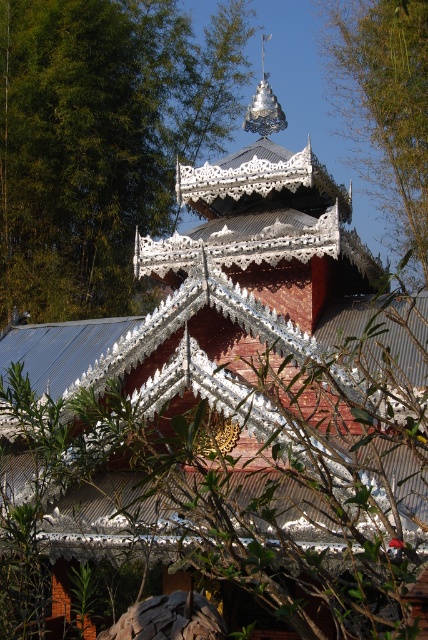
Is green leafy tree at upper left shorter than shiny silver spire at upper center?

→ In fact, green leafy tree at upper left may be taller than shiny silver spire at upper center.

Is green leafy tree at upper left below shiny silver spire at upper center?

Yes, green leafy tree at upper left is below shiny silver spire at upper center.

Between point (95, 48) and point (262, 58), which one is positioned behind?

The point (262, 58) is behind.

The image size is (428, 640). I want to click on green leafy tree at upper left, so click(101, 138).

Who is taller, green leafy tree at upper center or shiny silver spire at upper center?

Standing taller between the two is green leafy tree at upper center.

Does green leafy tree at upper center have a larger size compared to shiny silver spire at upper center?

Yes, green leafy tree at upper center is bigger than shiny silver spire at upper center.

Which is in front, point (412, 200) or point (267, 93)?

Point (267, 93) is in front.

This screenshot has width=428, height=640. In order to click on green leafy tree at upper center in this screenshot , I will do `click(385, 106)`.

Between point (39, 134) and point (409, 38), which one is positioned behind?

Positioned behind is point (39, 134).

Does green leafy tree at upper left appear under green leafy tree at upper center?

Correct, green leafy tree at upper left is located below green leafy tree at upper center.

Locate an element on the screen. The height and width of the screenshot is (640, 428). green leafy tree at upper left is located at coordinates (101, 138).

The height and width of the screenshot is (640, 428). Identify the location of green leafy tree at upper left. point(101,138).